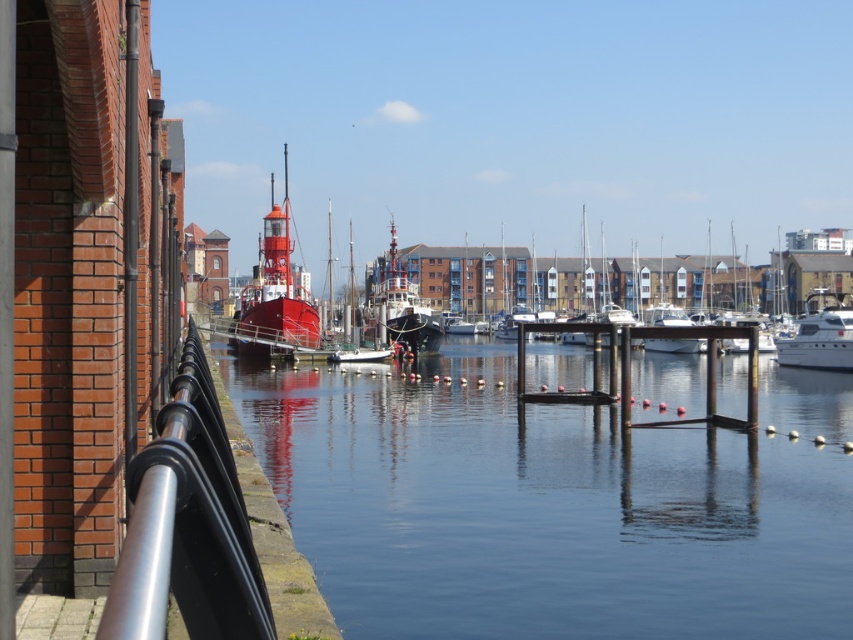
Is point (270, 177) positioned after point (782, 342)?

Yes, point (270, 177) is behind point (782, 342).

The image size is (853, 640). What are the coordinates of `shiny red boat at center` in the screenshot? It's located at (274, 292).

You are a GUI agent. You are given a task and a screenshot of the screen. Output one action in this format:
    pyautogui.click(x=<x>, y=<y>)
    Task: Click on the shiny red boat at center
    
    Given the screenshot: What is the action you would take?
    pyautogui.click(x=274, y=292)

Which of these two, white glossy boat at right or metallic red boat at center, stands shorter?

Standing shorter between the two is white glossy boat at right.

Is white glossy boat at right positioned behind metallic red boat at center?

No, it is not.

Is point (814, 365) behind point (349, 321)?

That is False.

Locate an element on the screen. Image resolution: width=853 pixels, height=640 pixels. white glossy boat at right is located at coordinates (820, 333).

Does point (279, 266) come closer to viewer compared to point (381, 294)?

Yes, point (279, 266) is in front of point (381, 294).

Who is more forward, (x=289, y=252) or (x=386, y=337)?

Point (x=386, y=337) is more forward.

I want to click on shiny red boat at center, so click(274, 292).